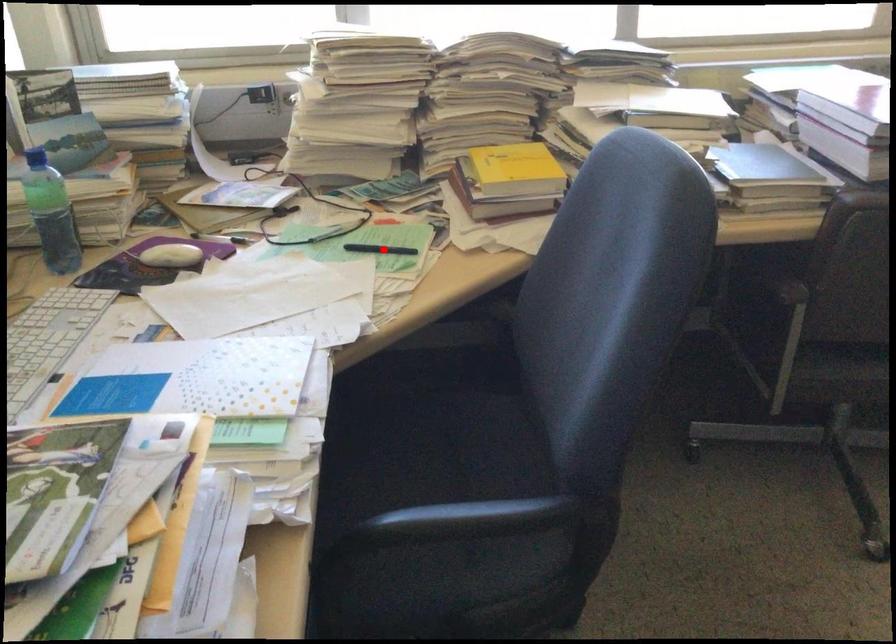
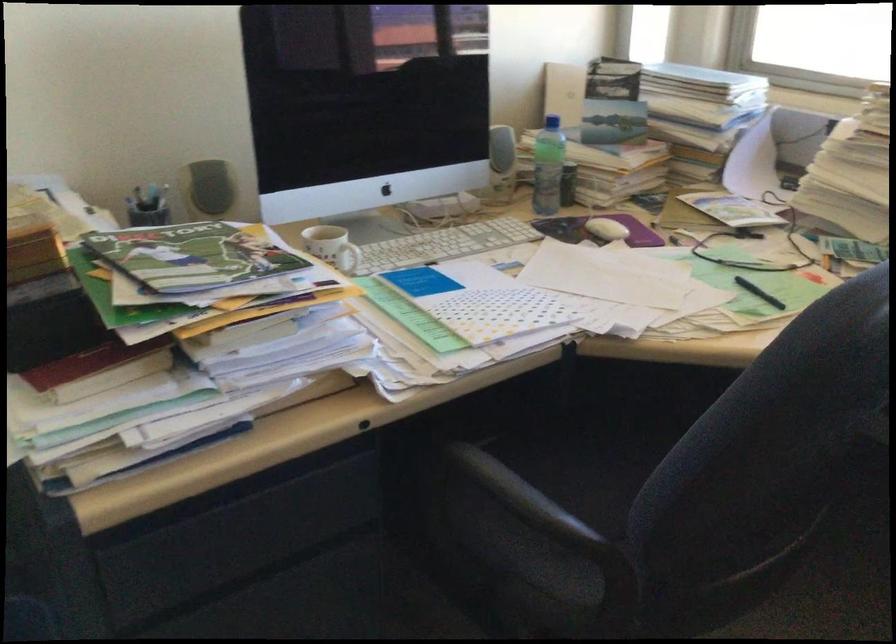
In the second image, find the point that corresponds to the highlighted location in the first image.

(759, 292)